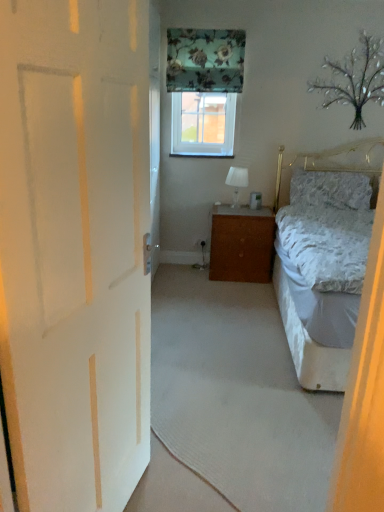
The image size is (384, 512). Identify the location of vacant position to the left of brown wood cabinet at center. (182, 274).